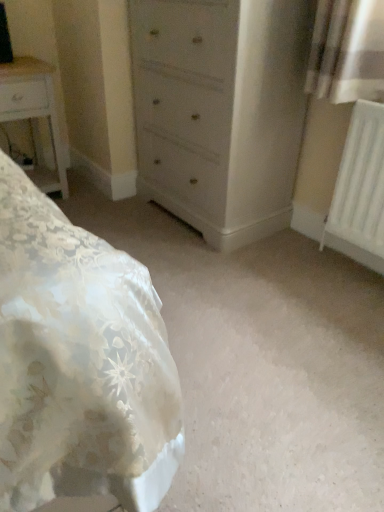
Question: Does white glossy nightstand at left have a greater height compared to light gray wood chest of drawers at center?

Choices:
 (A) no
 (B) yes

Answer: (A)

Question: Is white glossy nightstand at left located outside light gray wood chest of drawers at center?

Choices:
 (A) no
 (B) yes

Answer: (B)

Question: From the image's perspective, is white glossy nightstand at left under light gray wood chest of drawers at center?

Choices:
 (A) yes
 (B) no

Answer: (A)

Question: From the image's perspective, does white glossy nightstand at left appear higher than light gray wood chest of drawers at center?

Choices:
 (A) no
 (B) yes

Answer: (A)

Question: Can you confirm if white glossy nightstand at left is shorter than light gray wood chest of drawers at center?

Choices:
 (A) no
 (B) yes

Answer: (B)

Question: Is white glossy nightstand at left directly adjacent to light gray wood chest of drawers at center?

Choices:
 (A) no
 (B) yes

Answer: (A)

Question: Does light gray wood chest of drawers at center have a greater height compared to white plastic radiator at right?

Choices:
 (A) yes
 (B) no

Answer: (A)

Question: From a real-world perspective, is light gray wood chest of drawers at center located beneath white plastic radiator at right?

Choices:
 (A) no
 (B) yes

Answer: (A)

Question: Is light gray wood chest of drawers at center oriented towards white plastic radiator at right?

Choices:
 (A) yes
 (B) no

Answer: (B)

Question: Considering the relative sizes of light gray wood chest of drawers at center and white plastic radiator at right in the image provided, is light gray wood chest of drawers at center thinner than white plastic radiator at right?

Choices:
 (A) no
 (B) yes

Answer: (A)

Question: From a real-world perspective, is light gray wood chest of drawers at center physically above white plastic radiator at right?

Choices:
 (A) no
 (B) yes

Answer: (B)

Question: Does light gray wood chest of drawers at center come behind white plastic radiator at right?

Choices:
 (A) yes
 (B) no

Answer: (A)

Question: Is white glossy nightstand at left positioned behind white plastic radiator at right?

Choices:
 (A) yes
 (B) no

Answer: (A)